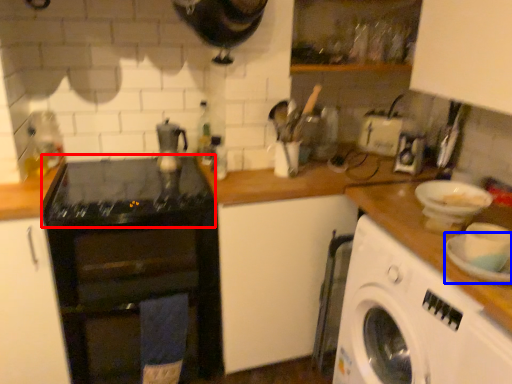
Question: Which of the following is the closest to the observer, gas stove (highlighted by a red box) or plate (highlighted by a blue box)?

Choices:
 (A) gas stove
 (B) plate

Answer: (B)